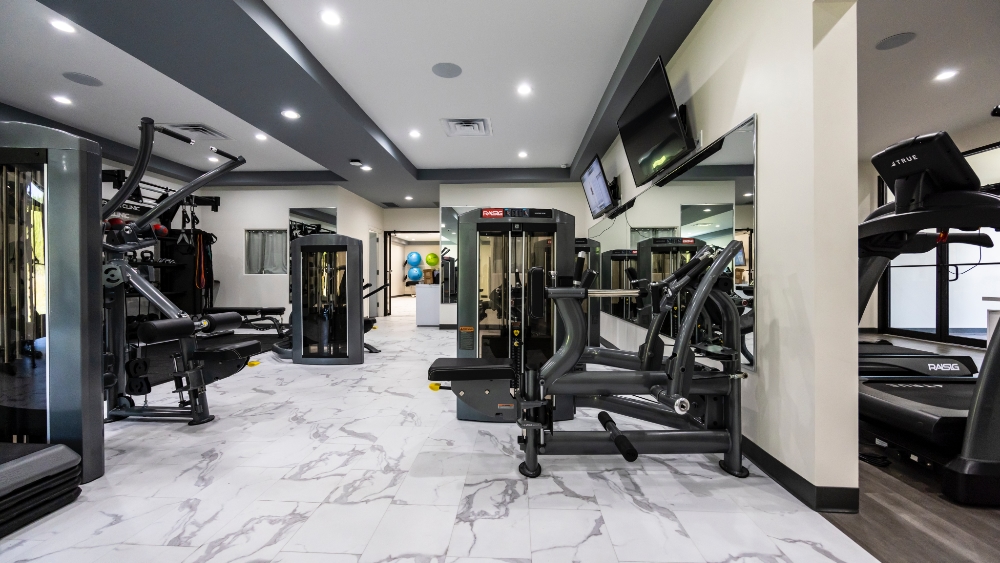
The width and height of the screenshot is (1000, 563). What are the coordinates of `exercise balls` in the screenshot? It's located at (414, 256), (417, 272), (431, 256).